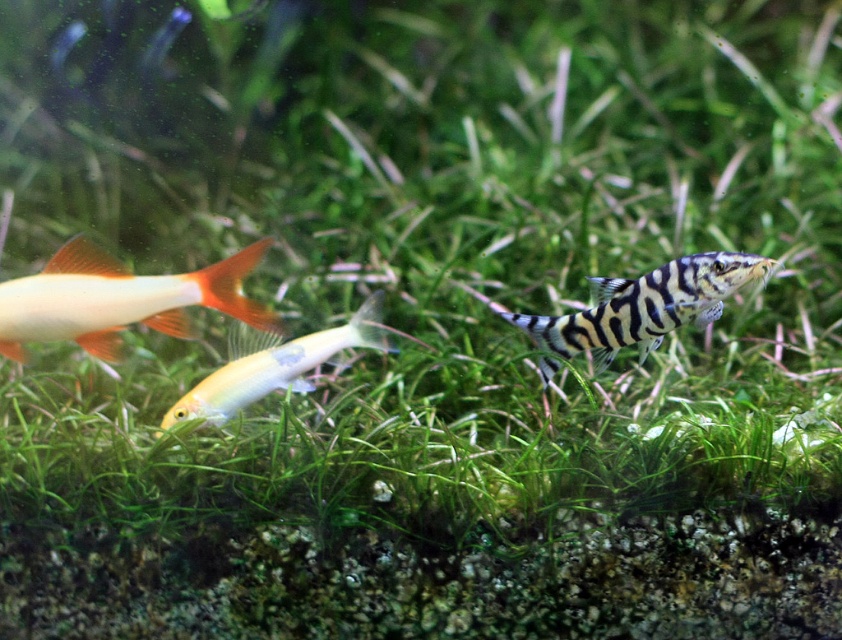
You are an underwater photographer aiming to capture a photo of both the shiny orange fish at left and the shiny yellow fish at center. Based on their sizes, which fish should you focus on first to ensure they appear larger in your shot?

The shiny yellow fish at center is taller than the shiny orange fish at left, so focusing on the shiny yellow fish at center first will ensure it appears larger in the photo.

You are an underwater photographer aiming to capture the shiny orange fish at left. Your camera is positioned at the center of the aquarium. Where should you aim your camera to ensure the fish is in the frame?

You should aim your camera towards the coordinates point (118, 300) where the shiny orange fish at left is located.

You are a marine biologist observing this underwater scene. You need to determine if the distance between the shiny orange fish at left and the black and white striped fish at center is sufficient for a small net to fit between them. The net requires at least 27 inches of space to operate effectively. Can the net be used between them?

The shiny orange fish at left and the black and white striped fish at center are 26.99 inches apart from each other. Since the required space for the net is 27 inches, the distance is just slightly insufficient. Therefore, the net cannot be used between them.